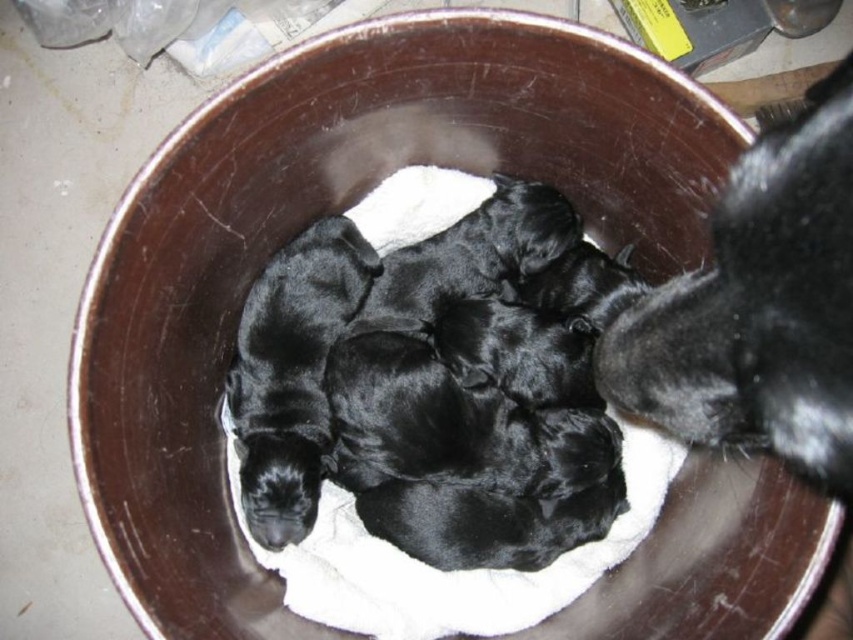
You are a dog breeder who needs to separate the black smooth puppies at center from the black fur at right. Based on their positions, which one is lower in the image?

The black smooth puppies at center is located below the black fur at right, so the puppies are lower in the image.

You are a photographer trying to capture a closeup of the black smooth puppies at center without the black fur at right appearing in the background. Based on their positions, can you achieve this?

The black smooth puppies at center are closer to you than the black fur at right, so you can focus on the puppies at center and the fur at right will be out of focus in the background.